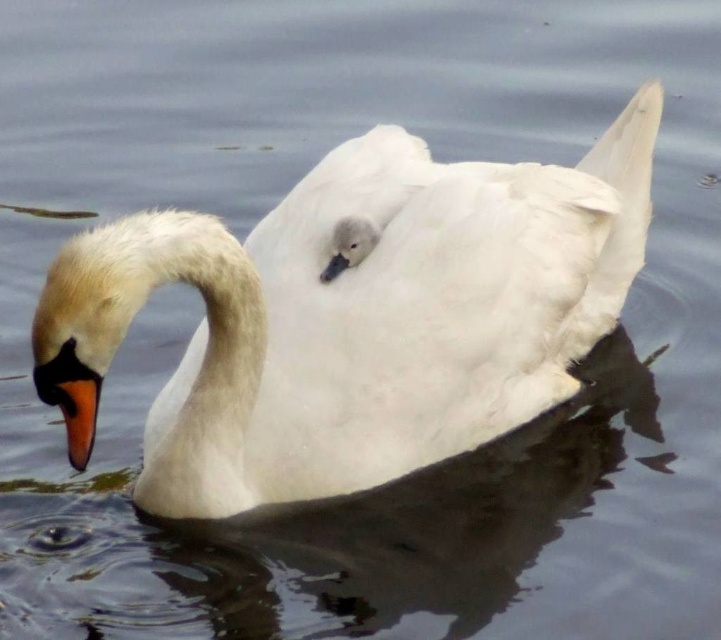
You are a birdwatcher observing the two swans in the scene. You notice the white matte swan at center and the orange matte beak at lower left. Which object is taller?

The white matte swan at center is much taller than the orange matte beak at lower left.

You are a photographer trying to capture a clear shot of the white matte swan at center and the orange matte beak at lower left. Which object will appear larger in your photo?

The white matte swan at center will appear larger in the photo because it is closer to the viewer than the orange matte beak at lower left.

You are standing at coordinates 0,0 and looking at the image. Where is the white matte swan at center located in terms of coordinates?

The white matte swan at center is located at coordinates approximately [360,314].